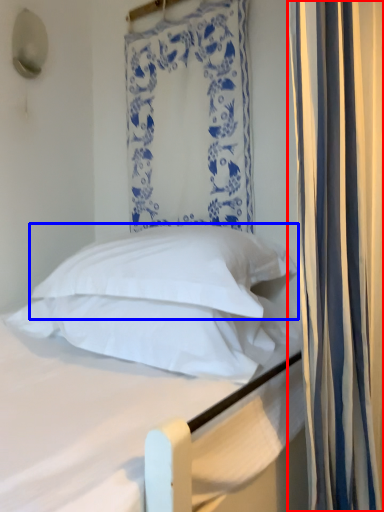
Question: Among these objects, which one is farthest to the camera, curtain (highlighted by a red box) or pillow (highlighted by a blue box)?

Choices:
 (A) curtain
 (B) pillow

Answer: (B)